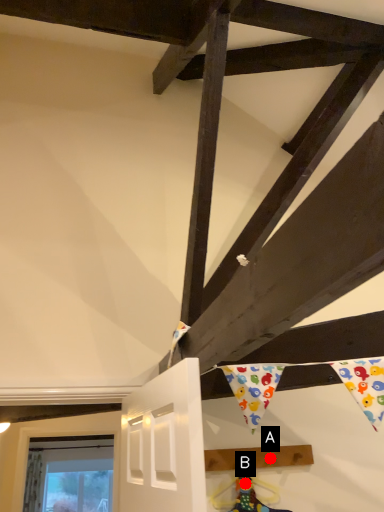
Question: Two points are circled on the image, labeled by A and B beside each circle. Which point appears closest to the camera in this image?

Choices:
 (A) A is closer
 (B) B is closer

Answer: (B)